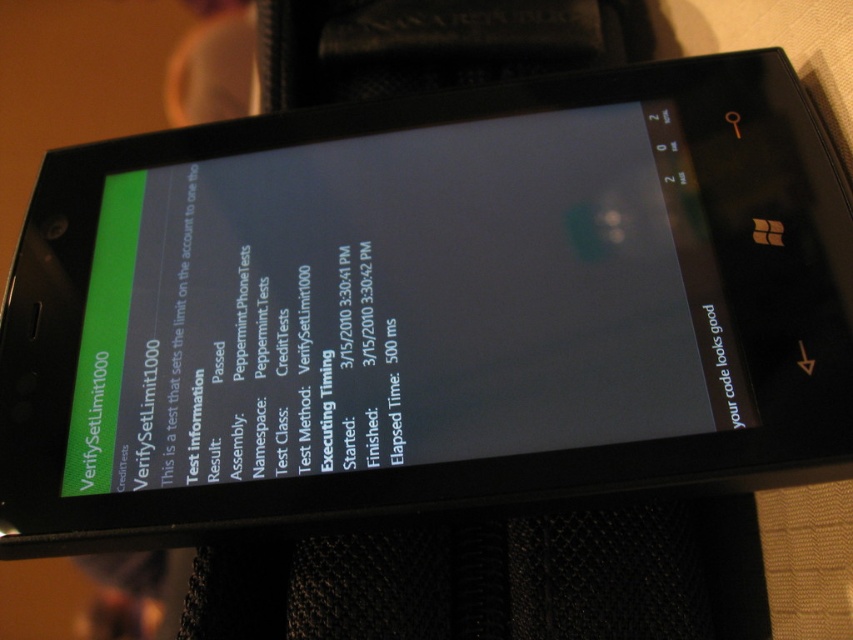
Is matte black screen at center bigger than green matte text at upper left?

Indeed, matte black screen at center has a larger size compared to green matte text at upper left.

Consider the image. Can you confirm if matte black screen at center is taller than green matte text at upper left?

Correct, matte black screen at center is much taller as green matte text at upper left.

This screenshot has height=640, width=853. Find the location of `matte black screen at center`. matte black screen at center is located at coordinates (401, 305).

I want to click on matte black screen at center, so click(401, 305).